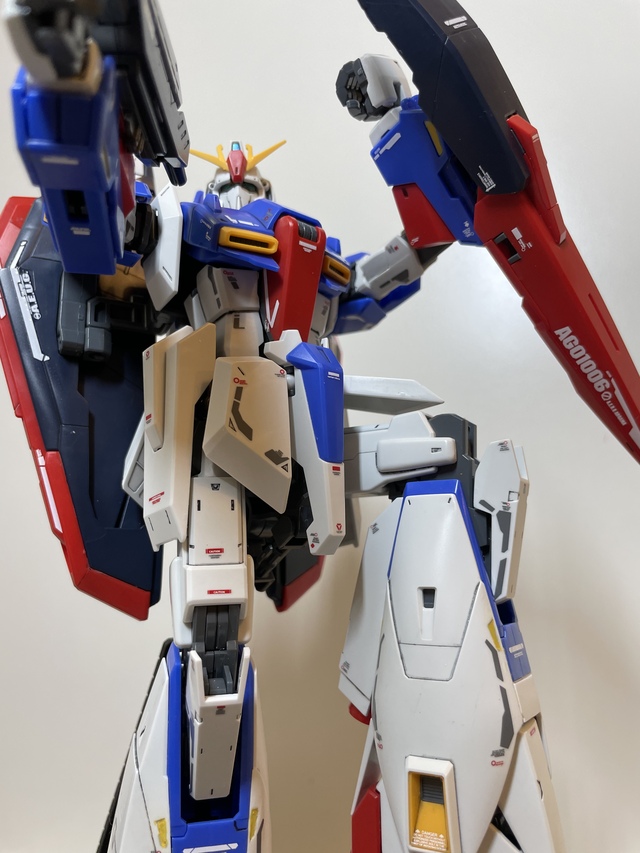
This screenshot has width=640, height=853. What are the coordinates of `chest` in the screenshot? It's located at (285, 223).